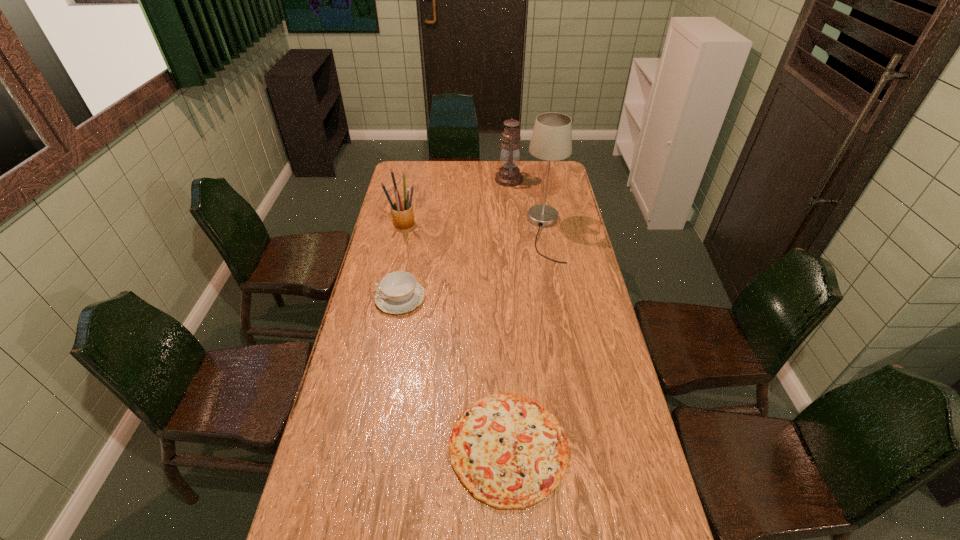
Locate an element on the screen. The height and width of the screenshot is (540, 960). vacant area located 0.300m on the back of the pencil box is located at coordinates (414, 178).

Image resolution: width=960 pixels, height=540 pixels. I want to click on vacant region located 0.050m on the handle side of the chinaware, so click(362, 298).

You are a GUI agent. You are given a task and a screenshot of the screen. Output one action in this format:
    pyautogui.click(x=<x>, y=<y>)
    Task: Click on the vacant region located 0.120m on the left of the pizza
    The width and height of the screenshot is (960, 540).
    Given the screenshot: What is the action you would take?
    pyautogui.click(x=404, y=447)

Where is `object present at the far edge`? Image resolution: width=960 pixels, height=540 pixels. object present at the far edge is located at coordinates (509, 175).

Where is `pencil box that is at the left edge`? pencil box that is at the left edge is located at coordinates (402, 213).

This screenshot has width=960, height=540. I want to click on chinaware located at the left edge, so click(399, 292).

Find the location of `object that is at the right edge`. object that is at the right edge is located at coordinates (551, 140).

Find the location of a particular element. This screenshot has width=960, height=540. vacant space at the far edge is located at coordinates (479, 170).

The image size is (960, 540). Find the location of `vacant point at the right edge`. vacant point at the right edge is located at coordinates (564, 200).

Locate an element on the screen. The width and height of the screenshot is (960, 540). vacant area at the far left corner of the desktop is located at coordinates (422, 184).